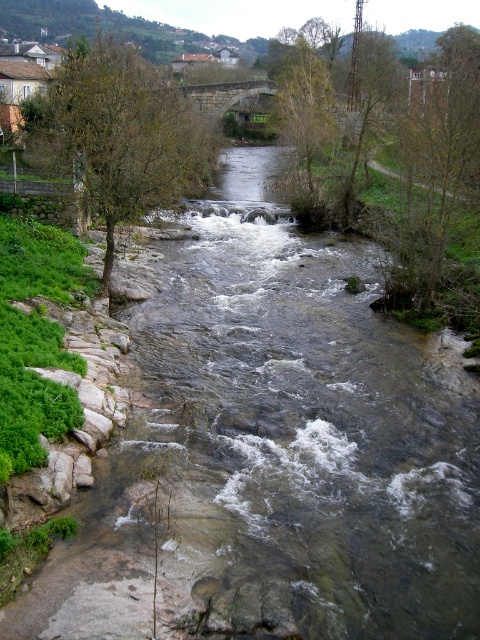
Is green leafy tree at left to the right of green leafy tree at upper right from the viewer's perspective?

In fact, green leafy tree at left is to the left of green leafy tree at upper right.

Between green leafy tree at left and green leafy tree at upper right, which one appears on the left side from the viewer's perspective?

green leafy tree at left is more to the left.

Identify the location of green leafy tree at left. The height and width of the screenshot is (640, 480). (120, 132).

Locate an element on the screen. This screenshot has height=640, width=480. green leafy tree at left is located at coordinates (120, 132).

Which is behind, point (178, 125) or point (332, 113)?

The point (178, 125) is behind.

Is green leafy tree at left to the right of green leafy tree at upper center from the viewer's perspective?

In fact, green leafy tree at left is to the left of green leafy tree at upper center.

What do you see at coordinates (120, 132) in the screenshot? I see `green leafy tree at left` at bounding box center [120, 132].

Where is `green leafy tree at left`? This screenshot has width=480, height=640. green leafy tree at left is located at coordinates (120, 132).

Who is taller, green leafy tree at upper right or green leafy tree at upper center?

green leafy tree at upper center is taller.

Measure the distance between green leafy tree at upper right and camera.

The distance of green leafy tree at upper right from camera is 57.32 feet.

Locate an element on the screen. green leafy tree at upper right is located at coordinates (434, 163).